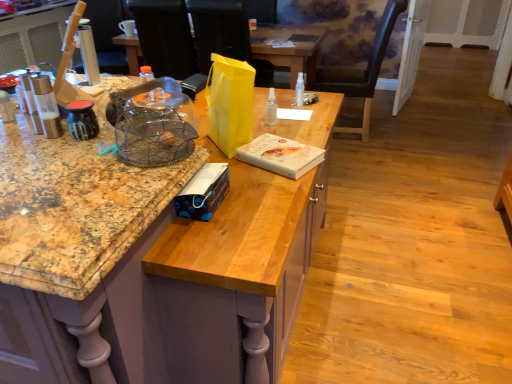
Question: Would you say black leather chair at upper right is inside or outside wire mesh birdcage at center?

Choices:
 (A) outside
 (B) inside

Answer: (A)

Question: Considering the positions of black leather chair at upper right and wire mesh birdcage at center in the image, is black leather chair at upper right wider or thinner than wire mesh birdcage at center?

Choices:
 (A) wide
 (B) thin

Answer: (A)

Question: Which object is the closest to the matte black kettle at left, the 1th kitchen appliance when ordered from right to left?

Choices:
 (A) wire mesh birdcage at center
 (B) wooden chair at upper left, marked as the third armchair in a right-to-left arrangement
 (C) black matte laptop at center
 (D) yellow paper bag at center, the 3th armchair in the left-to-right sequence
 (E) transparent plastic bottle at center, the first bottle from the left

Answer: (A)

Question: Which is nearer to the wire mesh birdcage at center?

Choices:
 (A) metallic glass salt shaker at left, which is counted as the second kitchen appliance, starting from the right
 (B) white matte book at center, arranged as the 2th box when viewed from the front
 (C) white matte coffee cup at upper center
 (D) yellow paper bag at center, the 3th armchair in the left-to-right sequence
 (E) black leather armchair at upper left, the second armchair positioned from the right

Answer: (A)